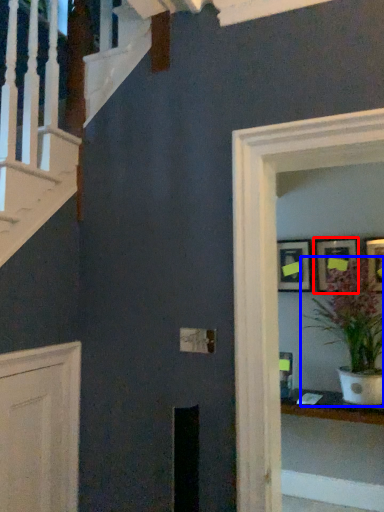
Question: Among these objects, which one is farthest to the camera, picture frame (highlighted by a red box) or houseplant (highlighted by a blue box)?

Choices:
 (A) picture frame
 (B) houseplant

Answer: (A)